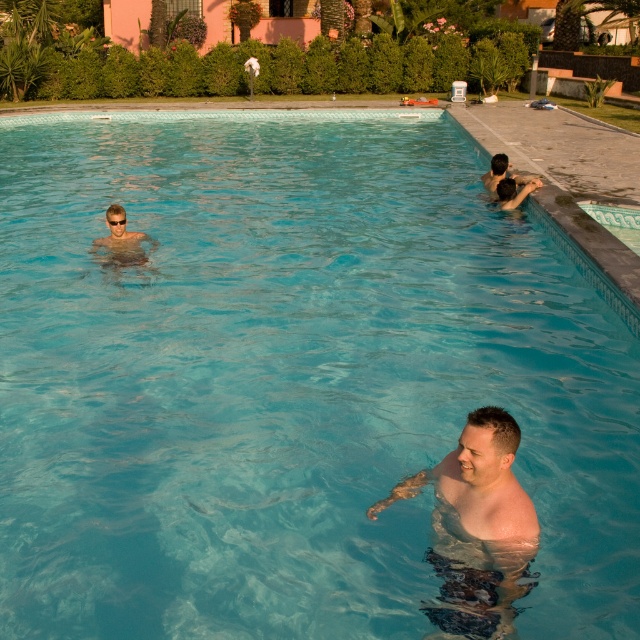
Based on the photo, does shiny skin man at center have a greater height compared to transparent plastic goggles at upper left?

Yes.

Which is below, shiny skin man at center or transparent plastic goggles at upper left?

shiny skin man at center is lower down.

The height and width of the screenshot is (640, 640). I want to click on shiny skin man at center, so click(x=476, y=529).

Where is `shiny skin man at center`? This screenshot has height=640, width=640. shiny skin man at center is located at coordinates (476, 529).